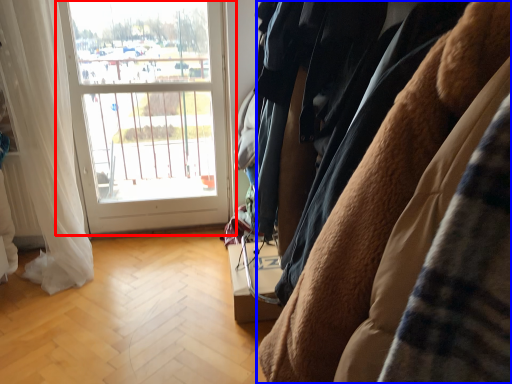
Question: Which object is closer to the camera taking this photo, window (highlighted by a red box) or furniture (highlighted by a blue box)?

Choices:
 (A) window
 (B) furniture

Answer: (B)